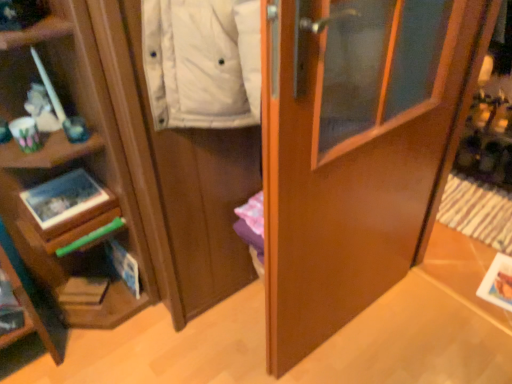
This screenshot has height=384, width=512. Find the location of `vacant area that lies in front of matte wood cabinet at left`. vacant area that lies in front of matte wood cabinet at left is located at coordinates (209, 343).